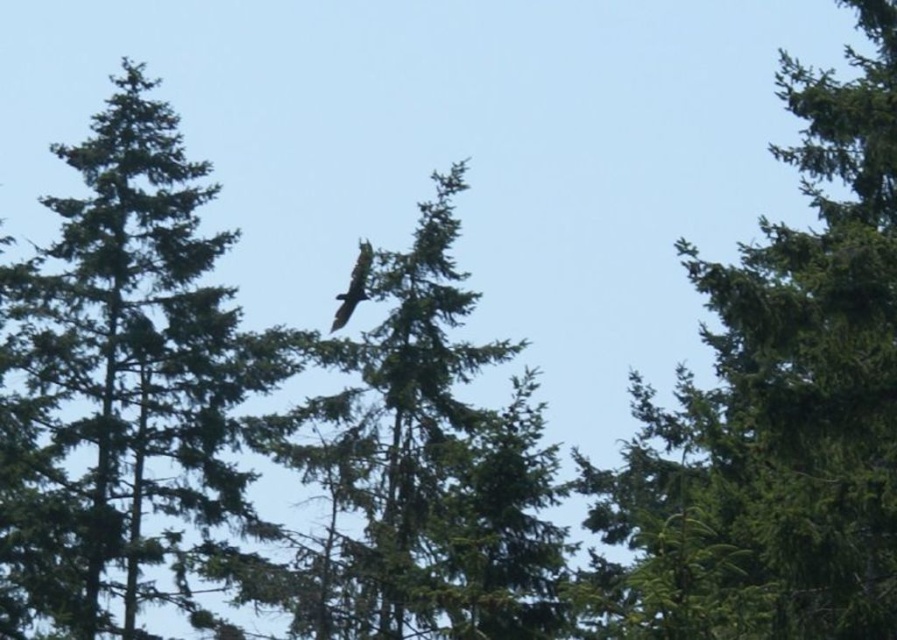
Identify the location of green textured tree at center. (129, 355).

Is green textured tree at center shorter than dark brown feathers at center?

No.

Between point (62, 586) and point (333, 330), which one is positioned in front?

Point (62, 586)

The height and width of the screenshot is (640, 897). Find the location of `green textured tree at center`. green textured tree at center is located at coordinates (129, 355).

Between green textured tree at upper center and dark brown feathers at center, which one is positioned lower?

Positioned lower is dark brown feathers at center.

Who is shorter, green textured tree at upper center or dark brown feathers at center?

Standing shorter between the two is dark brown feathers at center.

The width and height of the screenshot is (897, 640). Describe the element at coordinates (782, 403) in the screenshot. I see `green textured tree at upper center` at that location.

Find the location of a particular element. green textured tree at upper center is located at coordinates (782, 403).

Is green textured tree at upper center wider than green textured tree at center?

Yes, green textured tree at upper center is wider than green textured tree at center.

Does green textured tree at upper center have a smaller size compared to green textured tree at center?

No, green textured tree at upper center is not smaller than green textured tree at center.

Identify the location of green textured tree at upper center. This screenshot has height=640, width=897. (782, 403).